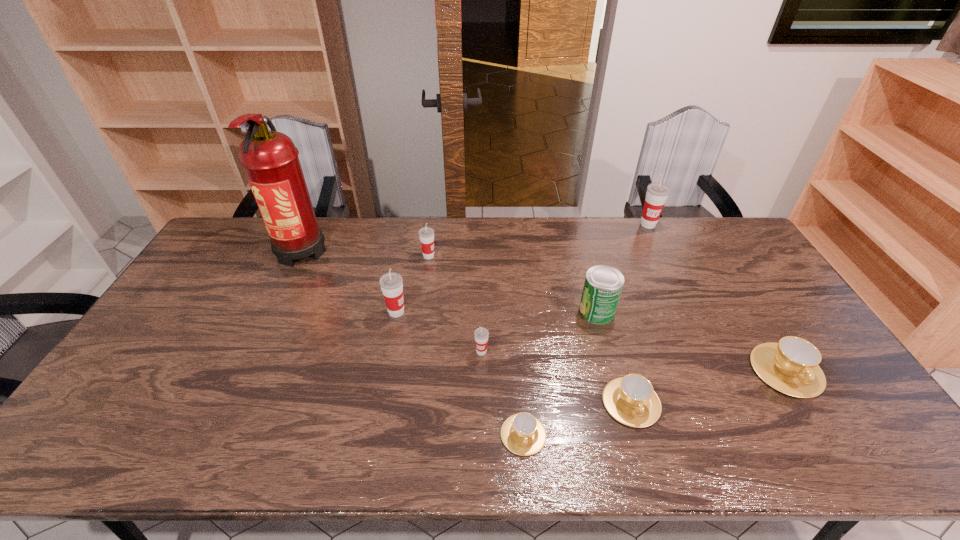
Identify the location of vacant space at the far right corner. This screenshot has width=960, height=540. pos(719,237).

Identify the location of free space between the leftmost red cup and the green can. Image resolution: width=960 pixels, height=540 pixels. (496, 311).

Where is `unoccupied area between the third farthest red cup and the fifth tallest cup`? unoccupied area between the third farthest red cup and the fifth tallest cup is located at coordinates (591, 341).

I want to click on unoccupied area between the second cup from left to right and the second brown cup from left to right, so click(530, 329).

Where is `vacant space that's between the third nearest red cup and the third red cup from left to right`? vacant space that's between the third nearest red cup and the third red cup from left to right is located at coordinates (455, 304).

At what (x,y) coordinates should I click in order to perform the action: click on vacant area that lies between the red fire extinguisher and the fourth cup from right to left. Please return your answer as a coordinate pair (x, y). The image size is (960, 540). Looking at the image, I should click on (413, 342).

Identify the location of vacant area that lies between the tallest object and the second farthest cup. (365, 253).

Where is `vacant space in between the third red cup from right to left and the green can`? This screenshot has height=540, width=960. vacant space in between the third red cup from right to left and the green can is located at coordinates (513, 284).

Where is `vacant area that lies between the second biggest brown cup and the fire extinguisher`? This screenshot has height=540, width=960. vacant area that lies between the second biggest brown cup and the fire extinguisher is located at coordinates (467, 326).

Choose which object is the third nearest neighbor to the third object from left to right. Please provide its 2D coordinates. Your answer should be formatted as a tuple, i.e. [(x, y)], where the tuple contains the x and y coordinates of a point satisfying the conditions above.

[(481, 334)]